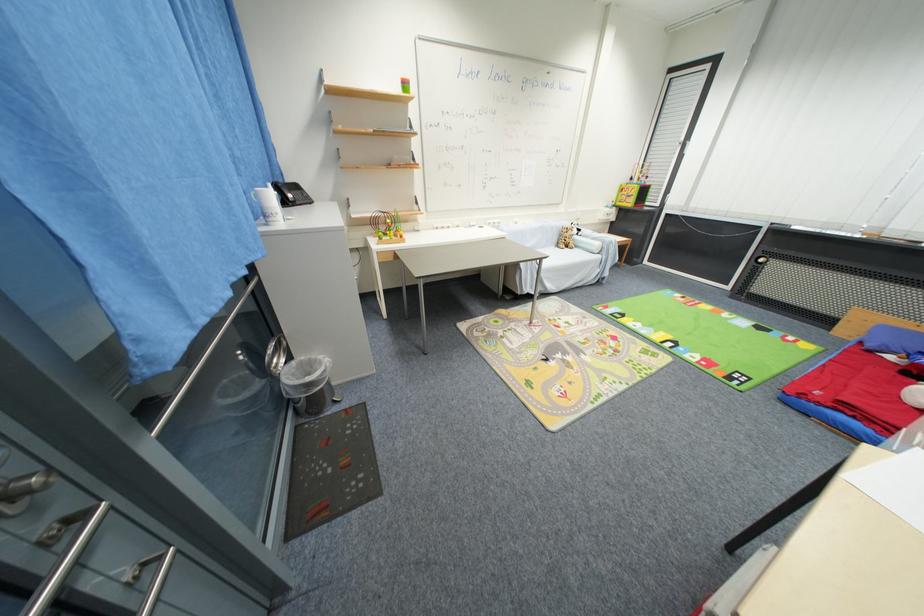
The height and width of the screenshot is (616, 924). What do you see at coordinates (631, 195) in the screenshot? I see `the green toy box` at bounding box center [631, 195].